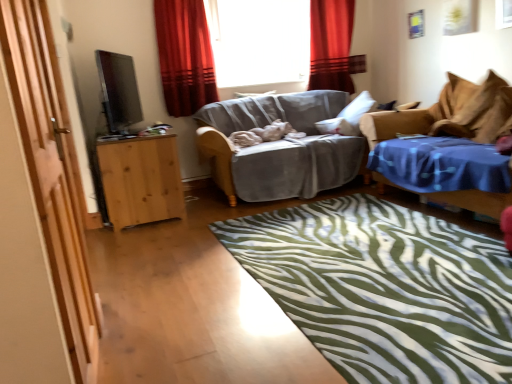
The image size is (512, 384). I want to click on free area in between wooden door at left and green zebra-patterned rug at center, so [205, 314].